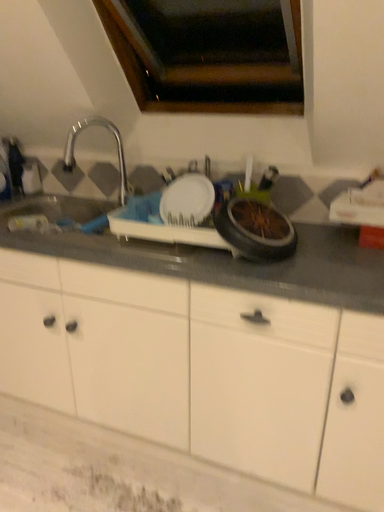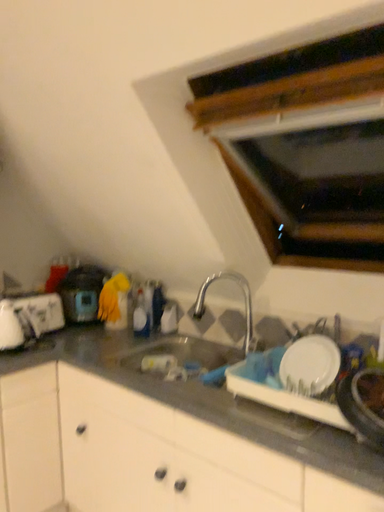
Question: How did the camera likely rotate when shooting the video?

Choices:
 (A) rotated right
 (B) rotated left

Answer: (B)